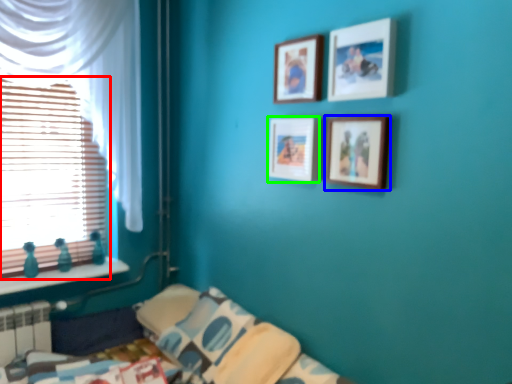
Question: Considering the real-world distances, which object is farthest from window (highlighted by a red box)? picture frame (highlighted by a blue box) or picture frame (highlighted by a green box)?

Choices:
 (A) picture frame
 (B) picture frame

Answer: (A)